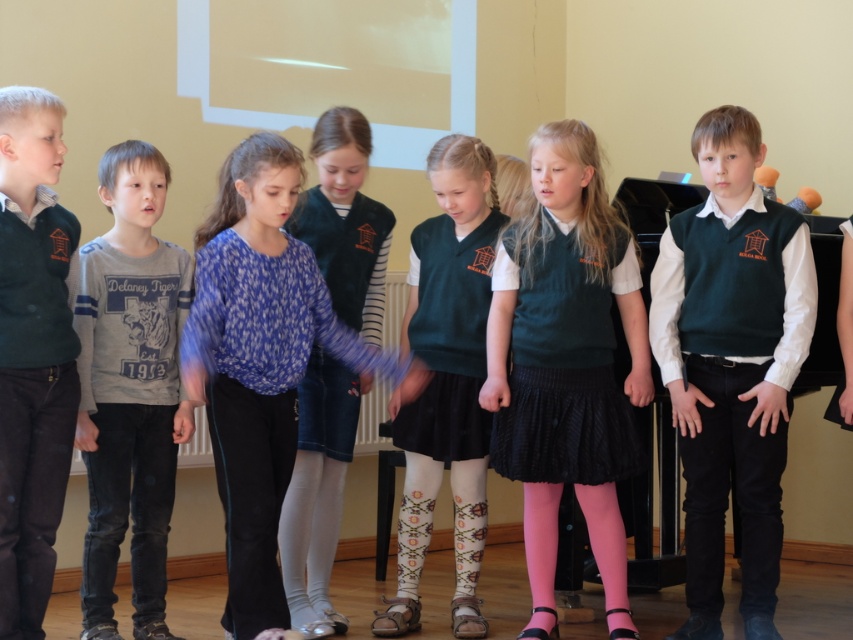
Does green matte vest at center have a larger size compared to matte blue dress at center?

No, green matte vest at center is not bigger than matte blue dress at center.

Consider the image. Between green matte vest at center and matte blue dress at center, which one is positioned higher?

matte blue dress at center

Does point (735, 344) come behind point (369, 248)?

No, it is not.

The image size is (853, 640). In order to click on green matte vest at center in this screenshot , I will do `click(730, 362)`.

Is blue printed blouse at center further to the viewer compared to matte green vest at center?

That is False.

Does blue printed blouse at center have a lesser height compared to matte green vest at center?

Yes.

Is point (218, 209) less distant than point (463, 436)?

That is True.

Where is `blue printed blouse at center`? This screenshot has height=640, width=853. blue printed blouse at center is located at coordinates (260, 362).

Find the location of a particular element. The image size is (853, 640). matte green sweater at left is located at coordinates (32, 353).